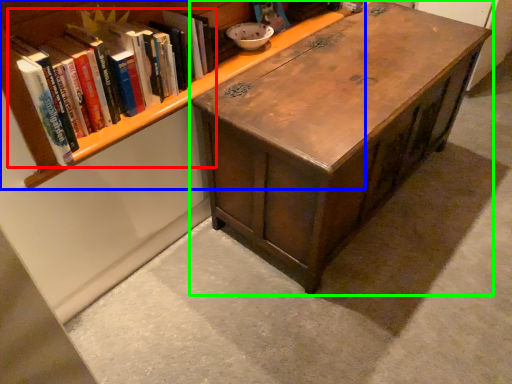
Question: Considering the real-world distances, which object is closest to book (highlighted by a red box)? bookcase (highlighted by a blue box) or table (highlighted by a green box).

Choices:
 (A) bookcase
 (B) table

Answer: (A)